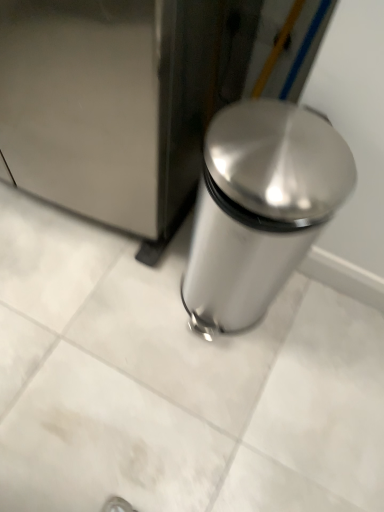
Question: Which is correct: satin silver trash can at right is inside satin silver trash can at center, or outside of it?

Choices:
 (A) inside
 (B) outside

Answer: (B)

Question: Is satin silver trash can at right bigger or smaller than satin silver trash can at center?

Choices:
 (A) small
 (B) big

Answer: (B)

Question: Is point (170, 74) positioned closer to the camera than point (331, 163)?

Choices:
 (A) farther
 (B) closer

Answer: (A)

Question: Relative to satin silver trash can at right, is satin silver trash can at center in front or behind?

Choices:
 (A) behind
 (B) front

Answer: (A)

Question: In terms of height, does satin silver trash can at center look taller or shorter compared to satin silver trash can at right?

Choices:
 (A) short
 (B) tall

Answer: (A)

Question: In the image, is satin silver trash can at center on the left side or the right side of satin silver trash can at right?

Choices:
 (A) left
 (B) right

Answer: (B)

Question: Looking at the image, does satin silver trash can at center seem bigger or smaller compared to satin silver trash can at right?

Choices:
 (A) small
 (B) big

Answer: (A)